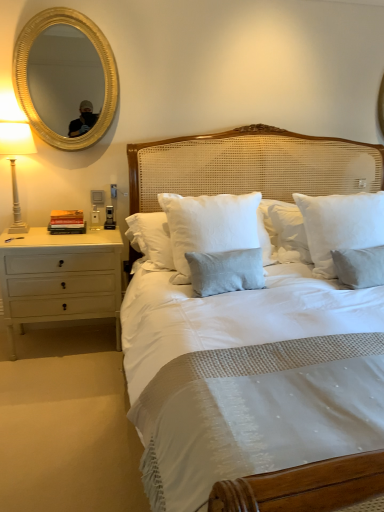
Locate an element on the screen. The width and height of the screenshot is (384, 512). gold metallic mirror at upper left is located at coordinates (65, 79).

The height and width of the screenshot is (512, 384). What do you see at coordinates (60, 278) in the screenshot? I see `white wood nightstand at left` at bounding box center [60, 278].

Where is `white cotton pillow at center, the second pillow from the right`? Image resolution: width=384 pixels, height=512 pixels. white cotton pillow at center, the second pillow from the right is located at coordinates (212, 227).

Measure the distance between white ceramic lamp at left and camera.

white ceramic lamp at left and camera are 8.36 feet apart from each other.

What are the coordinates of `gold metallic mirror at upper left` in the screenshot? It's located at (65, 79).

Is gold metallic mirror at upper left facing towards white ceramic lamp at left?

No, gold metallic mirror at upper left does not turn towards white ceramic lamp at left.

Is gold metallic mirror at upper left taller than white ceramic lamp at left?

Yes.

Is gold metallic mirror at upper left at the left side of white ceramic lamp at left?

Incorrect, gold metallic mirror at upper left is not on the left side of white ceramic lamp at left.

Consider the image. From the image's perspective, who appears lower, gold metallic mirror at upper left or white ceramic lamp at left?

white ceramic lamp at left.

Who is bigger, white cotton pillow at center, the second pillow from the right, or white cotton pillow at center, the 2th pillow viewed from the left?

With larger size is white cotton pillow at center, the second pillow from the right.

Based on the photo, does white cotton pillow at center, marked as the 1th pillow in a left-to-right arrangement, turn towards white cotton pillow at center, the 2th pillow viewed from the left?

No, white cotton pillow at center, marked as the 1th pillow in a left-to-right arrangement, is not aimed at white cotton pillow at center, the 2th pillow viewed from the left.

Could white cotton pillow at center, the 2th pillow viewed from the left, be considered to be inside white cotton pillow at center, the second pillow from the right?

No, white cotton pillow at center, the 2th pillow viewed from the left, is not inside white cotton pillow at center, the second pillow from the right.

Is the surface of white ceramic lamp at left in direct contact with white cotton pillow at center, the 2th pillow viewed from the left?

No, white ceramic lamp at left is not making contact with white cotton pillow at center, the 2th pillow viewed from the left.

From the image's perspective, is white ceramic lamp at left positioned above or below white cotton pillow at center, marked as the 1th pillow in a right-to-left arrangement?

From the image's perspective, white ceramic lamp at left appears above white cotton pillow at center, marked as the 1th pillow in a right-to-left arrangement.

Is point (12, 149) closer or farther from the camera than point (362, 234)?

Clearly, point (12, 149) is more distant from the camera than point (362, 234).

From a real-world perspective, is white ceramic lamp at left located beneath white cotton pillow at center, the 2th pillow viewed from the left?

No.

In the scene shown: From the image's perspective, which is above, gold metallic mirror at upper left or white wood nightstand at left?

gold metallic mirror at upper left is shown above in the image.

Does gold metallic mirror at upper left turn towards white wood nightstand at left?

No, gold metallic mirror at upper left is not facing towards white wood nightstand at left.

In the scene shown: Is gold metallic mirror at upper left bigger than white wood nightstand at left?

Incorrect, gold metallic mirror at upper left is not larger than white wood nightstand at left.

Is point (67, 86) behind point (31, 295)?

Yes, it is.

From a real-world perspective, is white cotton pillow at center, the second pillow from the right, on top of gold metallic mirror at upper left?

No, from a real-world perspective, white cotton pillow at center, the second pillow from the right, is not above gold metallic mirror at upper left.

Between white cotton pillow at center, the second pillow from the right, and gold metallic mirror at upper left, which one has more height?

Standing taller between the two is gold metallic mirror at upper left.

This screenshot has height=512, width=384. Find the location of `mirror above the white cotton pillow at center, marked as the 1th pillow in a left-to-right arrangement (from the image's perspective)`. mirror above the white cotton pillow at center, marked as the 1th pillow in a left-to-right arrangement (from the image's perspective) is located at coordinates (65, 79).

Who is smaller, white cotton pillow at center, the second pillow from the right, or gold metallic mirror at upper left?

Smaller between the two is gold metallic mirror at upper left.

Is white ceramic lamp at left taller or shorter than white cotton pillow at center, marked as the 1th pillow in a left-to-right arrangement?

Considering their sizes, white ceramic lamp at left has less height than white cotton pillow at center, marked as the 1th pillow in a left-to-right arrangement.

From a real-world perspective, is white ceramic lamp at left physically located above or below white cotton pillow at center, the second pillow from the right?

In terms of real-world spatial position, white ceramic lamp at left is above white cotton pillow at center, the second pillow from the right.

Can you confirm if white ceramic lamp at left is thinner than white cotton pillow at center, the second pillow from the right?

Incorrect, the width of white ceramic lamp at left is not less than that of white cotton pillow at center, the second pillow from the right.

Is white ceramic lamp at left far from white cotton pillow at center, marked as the 1th pillow in a left-to-right arrangement?

white ceramic lamp at left is far away from white cotton pillow at center, marked as the 1th pillow in a left-to-right arrangement.

In the scene shown: Can you tell me how much white wood nightstand at left and gold metallic mirror at upper left differ in facing direction?

The facing directions of white wood nightstand at left and gold metallic mirror at upper left are 0.566 degrees apart.

Locate an element on the screen. mirror positioned vertically above the white wood nightstand at left (from a real-world perspective) is located at coordinates (65, 79).

From the image's perspective, between white wood nightstand at left and gold metallic mirror at upper left, who is located below?

white wood nightstand at left is shown below in the image.

Based on the photo, which object is closer to the camera, white wood nightstand at left or gold metallic mirror at upper left?

gold metallic mirror at upper left is closer to the camera.

Identify the location of bedside lamp in front of the gold metallic mirror at upper left. (15, 160).

The width and height of the screenshot is (384, 512). I want to click on pillow above the white cotton pillow at center, the second pillow from the right (from a real-world perspective), so click(x=340, y=225).

Which object lies nearer to the anchor point white wood nightstand at left, white cotton pillow at center, the second pillow from the right, or gold metallic mirror at upper left?

white cotton pillow at center, the second pillow from the right, is closer to white wood nightstand at left.

Based on their spatial positions, is white ceramic lamp at left or white cotton pillow at center, marked as the 1th pillow in a left-to-right arrangement, further from white wood nightstand at left?

white cotton pillow at center, marked as the 1th pillow in a left-to-right arrangement, is positioned further to the anchor white wood nightstand at left.

When comparing their distances from white ceramic lamp at left, does white wood nightstand at left or white cotton pillow at center, marked as the 1th pillow in a right-to-left arrangement, seem closer?

white wood nightstand at left is positioned closer to the anchor white ceramic lamp at left.

Based on their spatial positions, is white cotton pillow at center, the second pillow from the right, or white wood nightstand at left closer to white cotton pillow at center, marked as the 1th pillow in a right-to-left arrangement?

Based on the image, white cotton pillow at center, the second pillow from the right, appears to be nearer to white cotton pillow at center, marked as the 1th pillow in a right-to-left arrangement.

Based on their spatial positions, is gold metallic mirror at upper left or white ceramic lamp at left further from white wood nightstand at left?

gold metallic mirror at upper left is positioned further to the anchor white wood nightstand at left.

Estimate the real-world distances between objects in this image. Which object is further from white ceramic lamp at left, gold metallic mirror at upper left or white wood nightstand at left?

white wood nightstand at left.

Based on their spatial positions, is white cotton pillow at center, marked as the 1th pillow in a left-to-right arrangement, or white cotton pillow at center, the 2th pillow viewed from the left, further from gold metallic mirror at upper left?

white cotton pillow at center, the 2th pillow viewed from the left, is positioned further to the anchor gold metallic mirror at upper left.

Which object lies nearer to the anchor point white cotton pillow at center, marked as the 1th pillow in a right-to-left arrangement, white ceramic lamp at left or white wood nightstand at left?

white wood nightstand at left.

I want to click on pillow between white ceramic lamp at left and white cotton pillow at center, marked as the 1th pillow in a right-to-left arrangement, in the horizontal direction, so click(x=212, y=227).

Where is `bedside lamp between gold metallic mirror at upper left and white wood nightstand at left in the up-down direction`? The image size is (384, 512). bedside lamp between gold metallic mirror at upper left and white wood nightstand at left in the up-down direction is located at coordinates (15, 160).

Where is `mirror between white wood nightstand at left and white cotton pillow at center, marked as the 1th pillow in a right-to-left arrangement, in the horizontal direction`? mirror between white wood nightstand at left and white cotton pillow at center, marked as the 1th pillow in a right-to-left arrangement, in the horizontal direction is located at coordinates (65, 79).

This screenshot has width=384, height=512. Identify the location of pillow between gold metallic mirror at upper left and white cotton pillow at center, the 2th pillow viewed from the left. (212, 227).